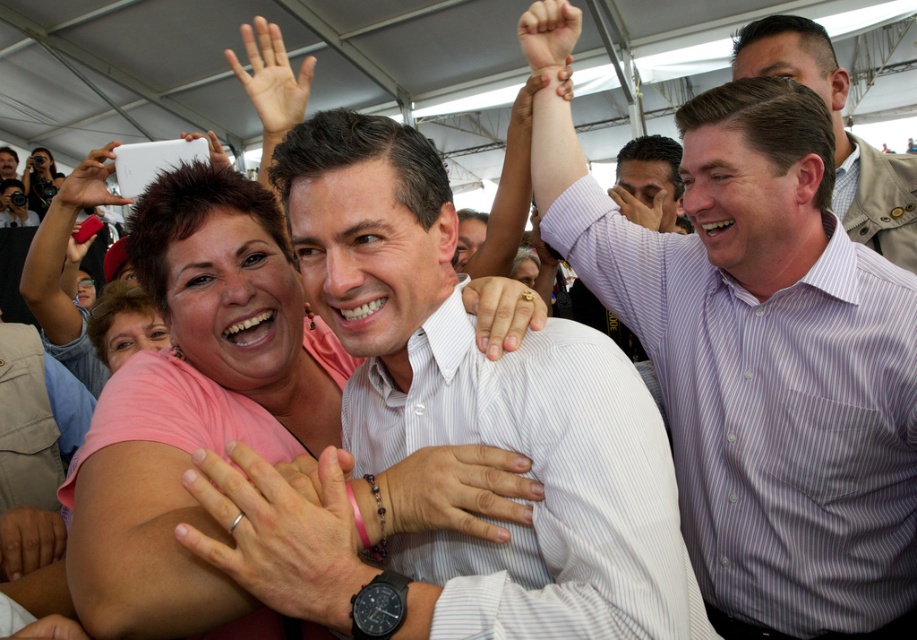
You are at a public event under a large white tent where three people are hugging. You see a matte skin hand at upper center and a white matte phone at upper left. Which object is positioned to the right of the other?

The matte skin hand at upper center is positioned to the right of the white matte phone at upper left.

In the scene shown: You are taking a photo of the scene and notice the matte skin hand at upper center and the white matte phone at upper left in your viewfinder. Which object will appear closer to you in the photo?

The matte skin hand at upper center will appear closer to you in the photo because it is positioned in front of the white matte phone at upper left.

You are at the event and want to take a photo of the matte black shirt at upper center and the white matte phone at upper left. Which object is wider so that it can fit better in your camera frame?

The matte black shirt at upper center is wider than the white matte phone at upper left, so it will fit better in the camera frame.